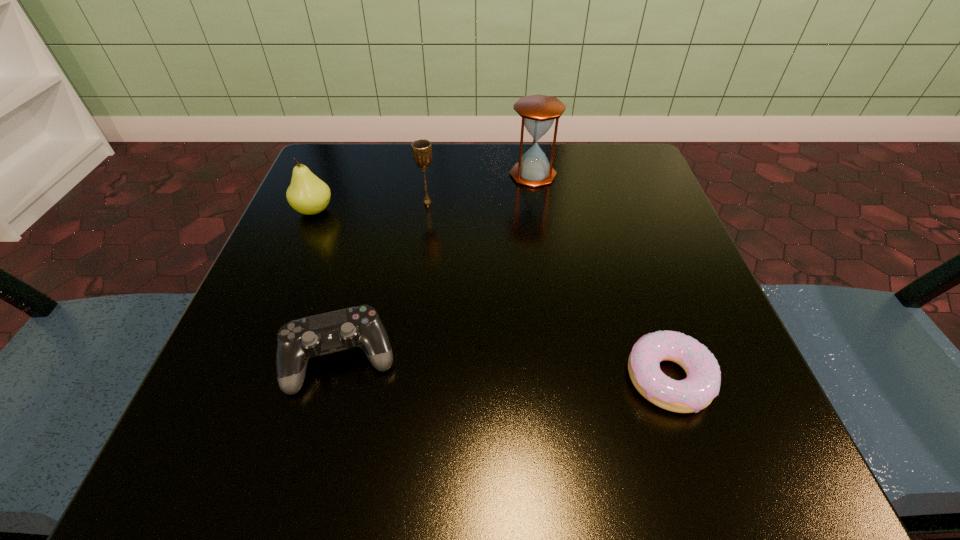
The image size is (960, 540). What are the coordinates of `unoccupied area between the pear and the rightmost object` in the screenshot? It's located at coord(492,294).

The image size is (960, 540). I want to click on free area in between the doughnut and the leftmost object, so click(492, 294).

Where is `free space that is in between the control and the leftmost object`? This screenshot has width=960, height=540. free space that is in between the control and the leftmost object is located at coordinates tap(327, 285).

The width and height of the screenshot is (960, 540). In order to click on blank region between the chalice and the leftmost object in this screenshot , I will do `click(371, 206)`.

Where is `free space between the leftmost object and the rightmost object`? This screenshot has width=960, height=540. free space between the leftmost object and the rightmost object is located at coordinates (492, 294).

Locate an element on the screen. unoccupied position between the shortest object and the pear is located at coordinates (492, 294).

This screenshot has width=960, height=540. Find the location of `empty space between the chalice and the leftmost object`. empty space between the chalice and the leftmost object is located at coordinates (371, 206).

Find the location of a particular element. The height and width of the screenshot is (540, 960). the third closest object to the tallest object is located at coordinates (702, 384).

Identify which object is the nearest to the pear. Please provide its 2D coordinates. Your answer should be formatted as a tuple, i.e. [(x, y)], where the tuple contains the x and y coordinates of a point satisfying the conditions above.

[(421, 149)]

This screenshot has height=540, width=960. Find the location of `vacant region that satisfies the following two spatial constraints: 1. on the front side of the rightmost object; 2. on the left side of the leftmost object`. vacant region that satisfies the following two spatial constraints: 1. on the front side of the rightmost object; 2. on the left side of the leftmost object is located at coordinates (243, 379).